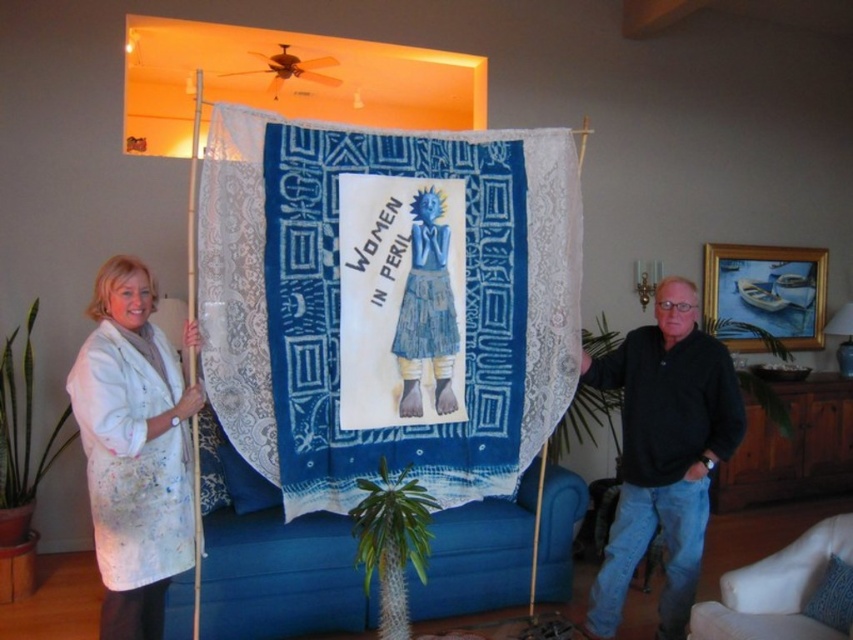
Question: Estimate the real-world distances between objects in this image. Which object is closer to the blue batik fabric at center?

Choices:
 (A) black cotton shirt at right
 (B) white fabric couch at lower right
 (C) white paint splattered coat at left

Answer: (C)

Question: Does blue batik fabric at center have a smaller size compared to white fabric couch at lower right?

Choices:
 (A) yes
 (B) no

Answer: (B)

Question: Does black cotton shirt at right have a smaller size compared to white fabric couch at lower right?

Choices:
 (A) yes
 (B) no

Answer: (B)

Question: Which point is farther to the camera?

Choices:
 (A) black cotton shirt at right
 (B) white paint splattered coat at left
 (C) blue batik fabric at center
 (D) white fabric couch at lower right

Answer: (A)

Question: Which object is the farthest from the blue batik fabric at center?

Choices:
 (A) black cotton shirt at right
 (B) white paint splattered coat at left
 (C) white fabric couch at lower right

Answer: (C)

Question: Is white paint splattered coat at left bigger than black cotton shirt at right?

Choices:
 (A) yes
 (B) no

Answer: (B)